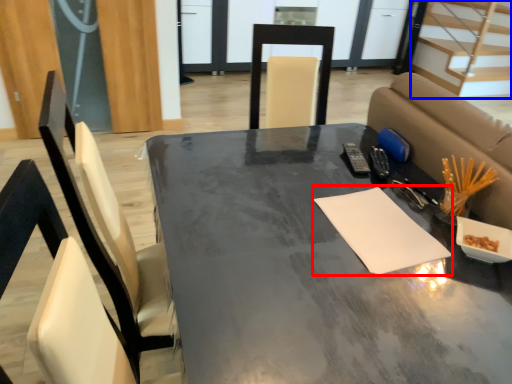
Question: Which point is further to the camera, notepad (highlighted by a red box) or stairwell (highlighted by a blue box)?

Choices:
 (A) notepad
 (B) stairwell

Answer: (B)